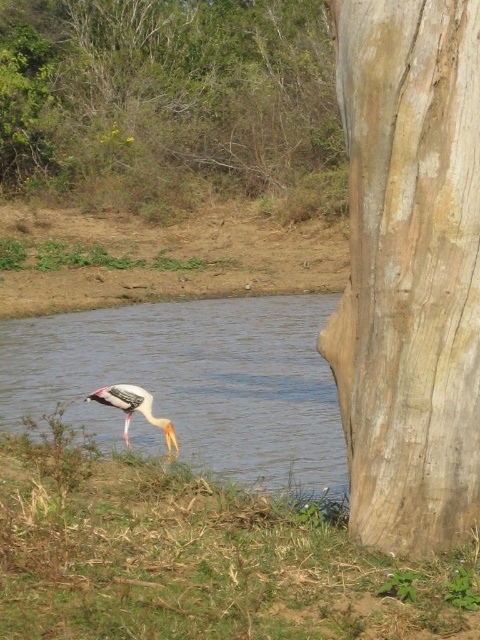
You are a small animal trying to cross from the green grass at lower left to the light brown rough bark at right. Which path would require less effort to traverse?

The light brown rough bark at right requires less effort to traverse because it is smaller than the green grass at lower left, making it easier to navigate for a small animal.

You are a photographer positioned at the edge of the water. You want to capture a photo of the green grass at lower left and the smooth brown water at lower left. Which object will appear closer to the camera in the photo?

The green grass at lower left is in front of the smooth brown water at lower left, so it will appear closer to the camera in the photo.